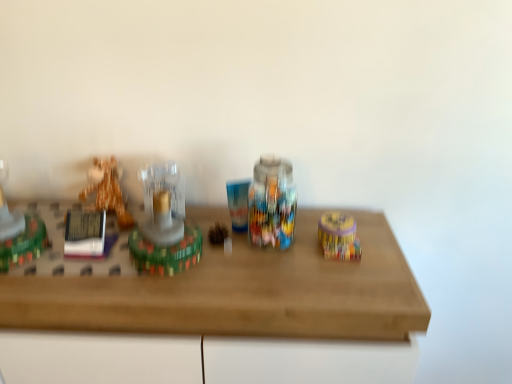
The image size is (512, 384). Find the location of `empty space that is to the right of shiny green plastic toy at left, acting as the 1th toy starting from the left`. empty space that is to the right of shiny green plastic toy at left, acting as the 1th toy starting from the left is located at coordinates (67, 269).